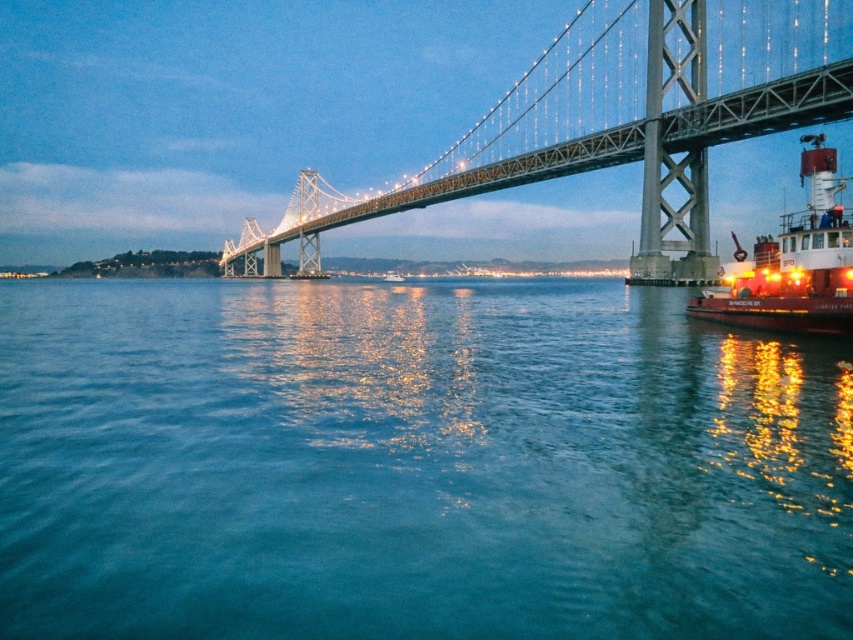
Question: Which of the following is the farthest from the observer?

Choices:
 (A) (675, 61)
 (B) (775, 241)
 (C) (619, 504)

Answer: (A)

Question: Is blue water at center bigger than red painted steel tugboat at right?

Choices:
 (A) no
 (B) yes

Answer: (B)

Question: Which point is closer to the camera?

Choices:
 (A) metallic gray suspension bridge at upper center
 (B) blue water at center
 (C) red painted steel tugboat at right

Answer: (B)

Question: In this image, where is blue water at center located relative to red painted steel tugboat at right?

Choices:
 (A) left
 (B) right

Answer: (A)

Question: Is blue water at center to the left of red painted steel tugboat at right from the viewer's perspective?

Choices:
 (A) no
 (B) yes

Answer: (B)

Question: Among these objects, which one is farthest from the camera?

Choices:
 (A) blue water at center
 (B) red painted steel tugboat at right
 (C) metallic gray suspension bridge at upper center

Answer: (C)